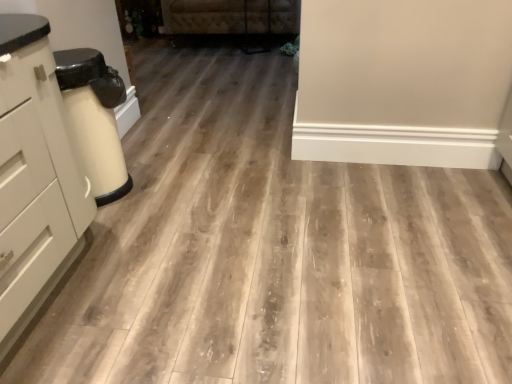
What are the coordinates of `matte white chest of drawers at left` in the screenshot? It's located at (34, 175).

This screenshot has height=384, width=512. Describe the element at coordinates (34, 175) in the screenshot. I see `matte white chest of drawers at left` at that location.

Find the location of a particular element. This screenshot has width=512, height=384. matte white chest of drawers at left is located at coordinates (34, 175).